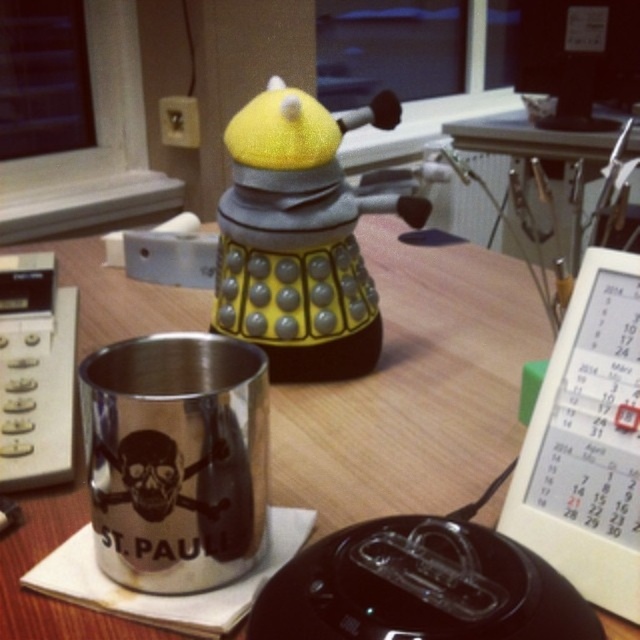
Question: Does metallic silver cup at center-left appear under stainless steel mug at lower left?

Choices:
 (A) no
 (B) yes

Answer: (A)

Question: Which of the following is the closest to the observer?

Choices:
 (A) metallic silver cup at center-left
 (B) stainless steel mug at lower left

Answer: (B)

Question: From the image, what is the correct spatial relationship of metallic silver cup at center-left in relation to stainless steel mug at lower left?

Choices:
 (A) left
 (B) right

Answer: (A)

Question: Is metallic silver cup at center-left in front of stainless steel mug at lower left?

Choices:
 (A) yes
 (B) no

Answer: (B)